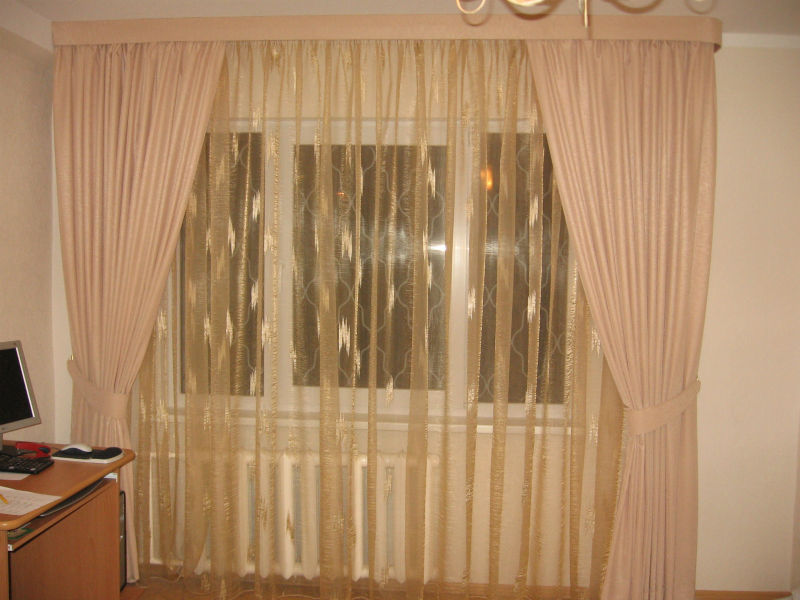
Identify the location of brown hardwood desk top. (69, 478).